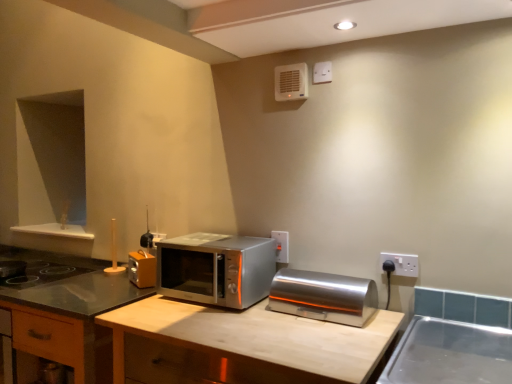
Image resolution: width=512 pixels, height=384 pixels. Identify the location of free region on the left part of satin silver toaster at center. (250, 316).